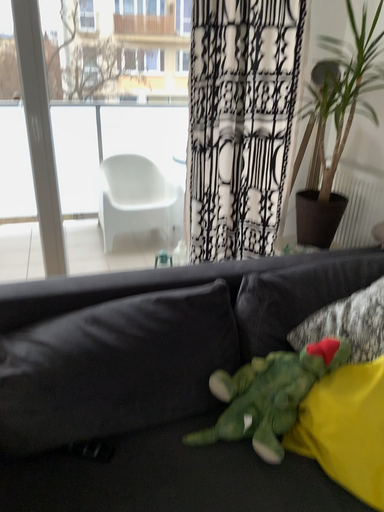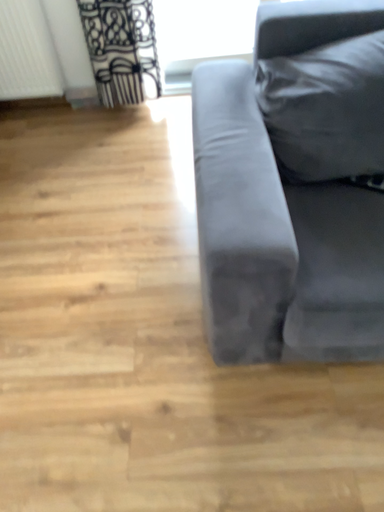
Question: How did the camera likely rotate when shooting the video?

Choices:
 (A) rotated right
 (B) rotated left

Answer: (B)